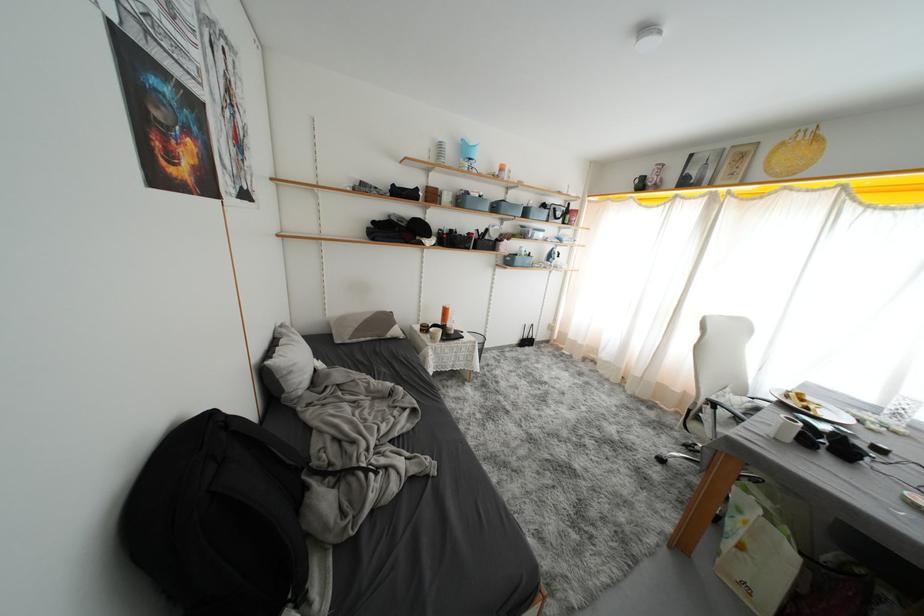
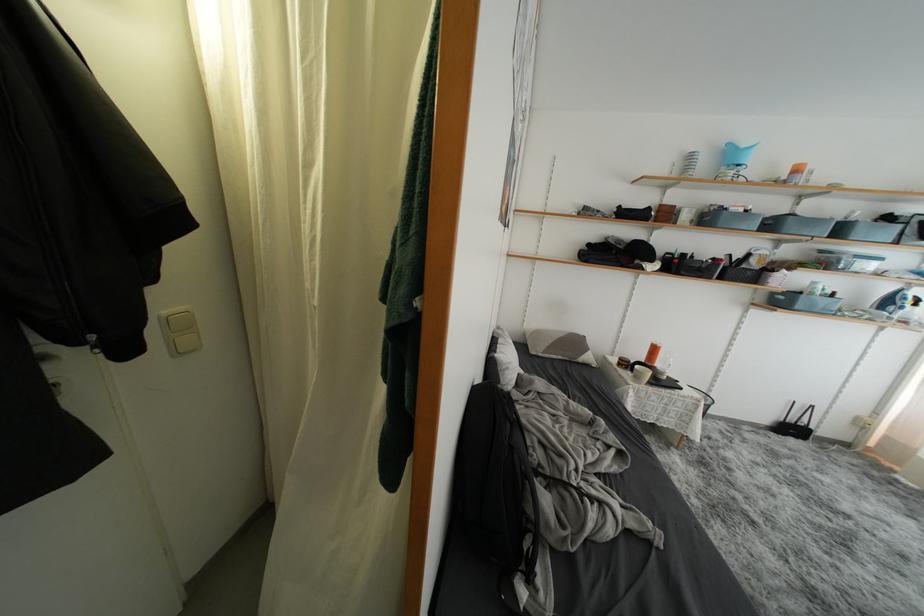
In the second image, find the point that corresponds to point 532,217 in the first image.

(847, 235)